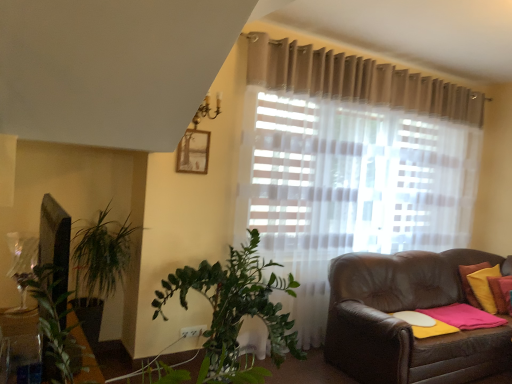
Question: Based on their positions, is yellow fabric pillow at right, acting as the 1th pillow starting from the right, located to the left or right of matte wooden picture frame at upper center?

Choices:
 (A) left
 (B) right

Answer: (B)

Question: Based on their sizes in the image, would you say yellow fabric pillow at right, acting as the 1th pillow starting from the right, is bigger or smaller than matte wooden picture frame at upper center?

Choices:
 (A) small
 (B) big

Answer: (B)

Question: Considering the real-world distances, which object is closest to the matte wooden picture frame at upper center?

Choices:
 (A) yellow fabric pillow at right, which ranks as the first pillow in left-to-right order
 (B) yellow fabric pillow at right, acting as the 1th pillow starting from the right

Answer: (B)

Question: Which is farther from the yellow fabric pillow at right, which is counted as the 2th pillow, starting from the right?

Choices:
 (A) yellow fabric pillow at right, acting as the 1th pillow starting from the right
 (B) matte wooden picture frame at upper center

Answer: (B)